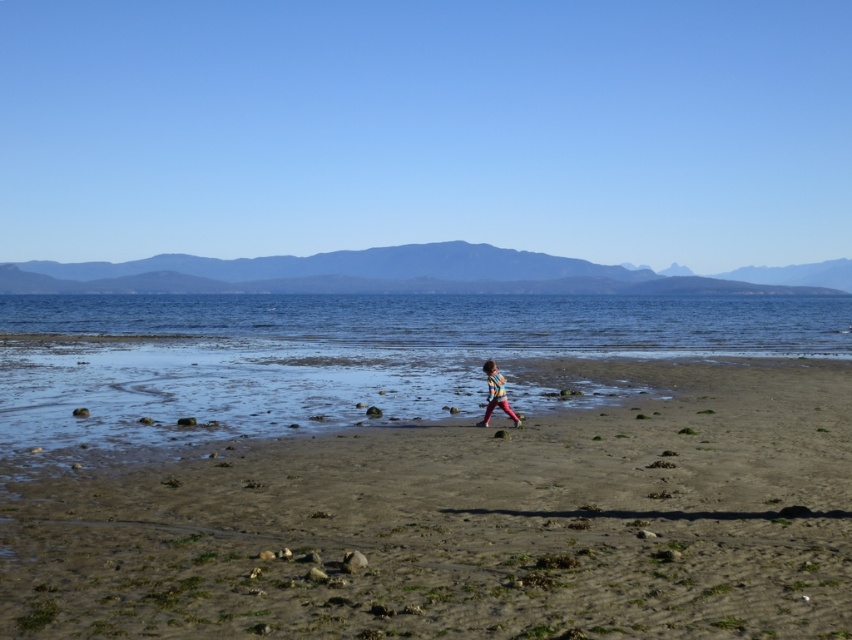
Is blue water at lower center bigger than striped shirt at center?

Correct, blue water at lower center is larger in size than striped shirt at center.

Is blue water at lower center to the left of striped shirt at center from the viewer's perspective?

Correct, you'll find blue water at lower center to the left of striped shirt at center.

Between point (263, 333) and point (498, 387), which one is positioned in front?

Point (498, 387) is in front.

The height and width of the screenshot is (640, 852). What are the coordinates of `blue water at lower center` in the screenshot? It's located at (453, 321).

Looking at this image, can you confirm if brown sandy beach at center is positioned to the right of blue water at lower center?

Yes, brown sandy beach at center is to the right of blue water at lower center.

Who is shorter, brown sandy beach at center or blue water at lower center?

brown sandy beach at center is shorter.

Between point (367, 451) and point (577, 340), which one is positioned in front?

Point (367, 451)

This screenshot has width=852, height=640. I want to click on brown sandy beach at center, so click(470, 524).

Is point (50, 625) farther from camera compared to point (486, 403)?

No, (50, 625) is closer to viewer.

Who is higher up, brown sandy beach at center or striped shirt at center?

Positioned higher is striped shirt at center.

Locate an element on the screen. brown sandy beach at center is located at coordinates (470, 524).